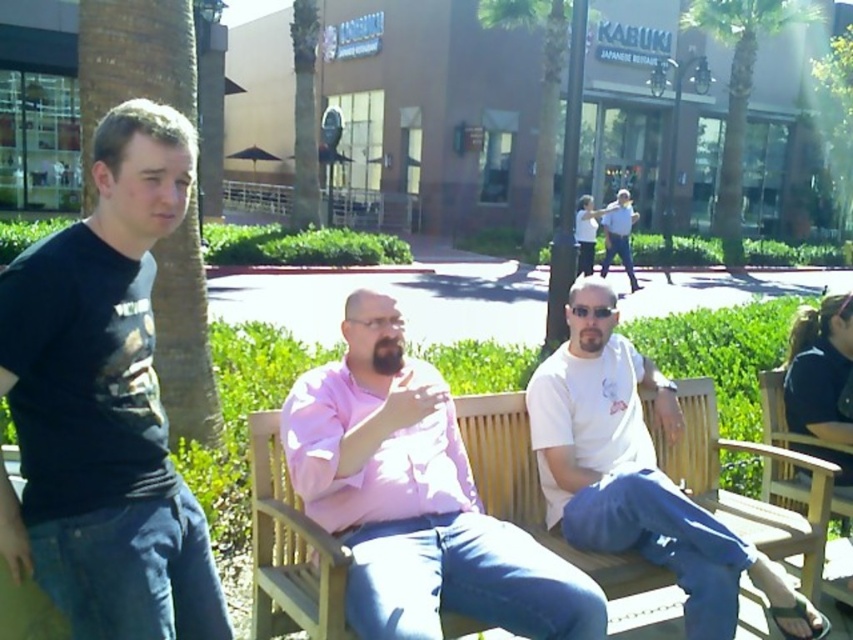
Between black cotton t-shirt at left and white cotton shirt at center, which one has more height?

black cotton t-shirt at left is taller.

At what (x,y) coordinates should I click in order to perform the action: click on black cotton t-shirt at left. Please return your answer as a coordinate pair (x, y). The image size is (853, 640). Looking at the image, I should click on (105, 403).

This screenshot has height=640, width=853. Identify the location of black cotton t-shirt at left. (105, 403).

Who is shorter, black cotton t-shirt at left or wooden bench at center?

wooden bench at center

Is black cotton t-shirt at left in front of wooden bench at center?

Yes.

Identify the location of black cotton t-shirt at left. (105, 403).

Between point (183, 554) and point (466, 593), which one is positioned in front?

Point (183, 554) is more forward.

Between point (154, 138) and point (434, 392), which one is positioned behind?

The point (434, 392) is behind.

This screenshot has width=853, height=640. What are the coordinates of `black cotton t-shirt at left` in the screenshot? It's located at (105, 403).